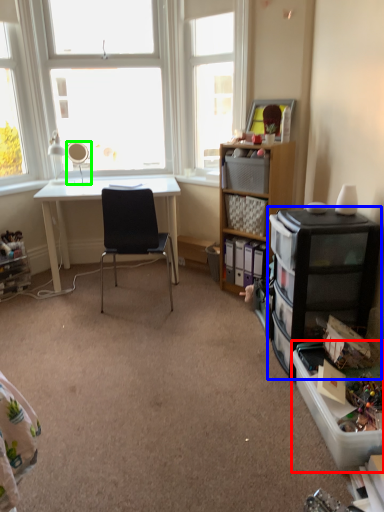
Question: Which object is positioned farthest from storage box (highlighted by a red box)? Select from cabinetry (highlighted by a blue box) and mirror (highlighted by a green box).

Choices:
 (A) cabinetry
 (B) mirror

Answer: (B)